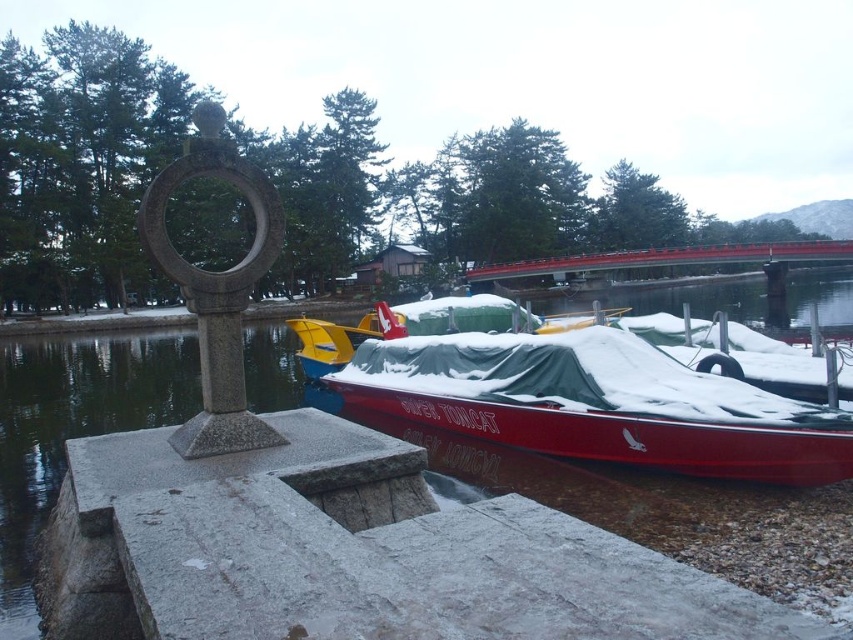
Based on the photo, you are standing on the red wood bridge at upper center and want to board the red glossy boat at center. Which direction should you move to reach it?

You should move downward from the red wood bridge at upper center to reach the red glossy boat at center since it is located below the bridge.

You are standing on the stone embankment and want to walk to the red glossy boat at center. Which direction should you head relative to the red wood bridge at upper center?

You should head to the left side of the red wood bridge at upper center to reach the red glossy boat at center because the red glossy boat at center is positioned on the left side of the red wood bridge at upper center.

You are planning to move the red glossy boat at center to the red wood bridge at upper center. Considering their widths, will the boat fit on the bridge without needing to be modified?

The red glossy boat at center is narrower than the red wood bridge at upper center, so it will fit without needing modifications.